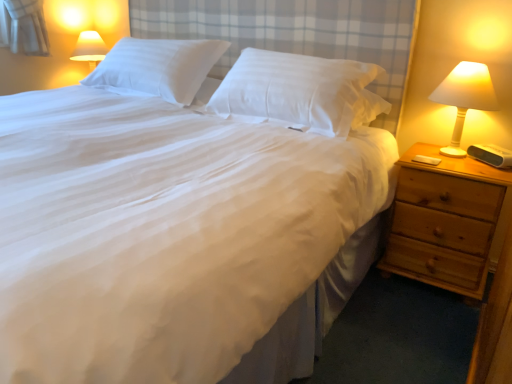
Question: Considering the relative sizes of light brown wooden nightstand at right and white smooth pillow at upper center, the 2th pillow in the right-to-left sequence, in the image provided, is light brown wooden nightstand at right shorter than white smooth pillow at upper center, the 2th pillow in the right-to-left sequence,?

Choices:
 (A) yes
 (B) no

Answer: (B)

Question: Would you say white smooth pillow at upper center, the first pillow from the left, is part of light brown wooden nightstand at right's contents?

Choices:
 (A) yes
 (B) no

Answer: (B)

Question: Is the position of light brown wooden nightstand at right less distant than that of white smooth pillow at upper center, the first pillow from the left?

Choices:
 (A) yes
 (B) no

Answer: (A)

Question: Considering the relative sizes of light brown wooden nightstand at right and white smooth pillow at upper center, the first pillow from the left, in the image provided, is light brown wooden nightstand at right smaller than white smooth pillow at upper center, the first pillow from the left,?

Choices:
 (A) yes
 (B) no

Answer: (B)

Question: From a real-world perspective, is light brown wooden nightstand at right on top of white smooth pillow at upper center, the first pillow from the left?

Choices:
 (A) no
 (B) yes

Answer: (A)

Question: Is light brown wooden nightstand at right thinner than white smooth pillow at upper center, the 2th pillow in the right-to-left sequence?

Choices:
 (A) no
 (B) yes

Answer: (A)

Question: Is white smooth pillow at upper center, the first pillow from the left, positioned in front of white smooth pillow at center, the 2th pillow from the left?

Choices:
 (A) no
 (B) yes

Answer: (A)

Question: Considering the relative sizes of white smooth pillow at upper center, the first pillow from the left, and white smooth pillow at center, the 2th pillow from the left, in the image provided, is white smooth pillow at upper center, the first pillow from the left, smaller than white smooth pillow at center, the 2th pillow from the left,?

Choices:
 (A) no
 (B) yes

Answer: (B)

Question: From a real-world perspective, is white smooth pillow at upper center, the first pillow from the left, under white smooth pillow at center, which is counted as the first pillow, starting from the right?

Choices:
 (A) no
 (B) yes

Answer: (A)

Question: Is white smooth pillow at upper center, the first pillow from the left, oriented away from white smooth pillow at center, which is counted as the first pillow, starting from the right?

Choices:
 (A) no
 (B) yes

Answer: (A)

Question: From the image's perspective, is white smooth pillow at upper center, the 2th pillow in the right-to-left sequence, under white smooth pillow at center, the 2th pillow from the left?

Choices:
 (A) yes
 (B) no

Answer: (B)

Question: From the image's perspective, would you say white smooth pillow at upper center, the 2th pillow in the right-to-left sequence, is positioned over white smooth pillow at center, which is counted as the first pillow, starting from the right?

Choices:
 (A) yes
 (B) no

Answer: (A)

Question: From the image's perspective, does white smooth pillow at center, the 2th pillow from the left, appear higher than white smooth pillow at upper center, the 2th pillow in the right-to-left sequence?

Choices:
 (A) yes
 (B) no

Answer: (B)